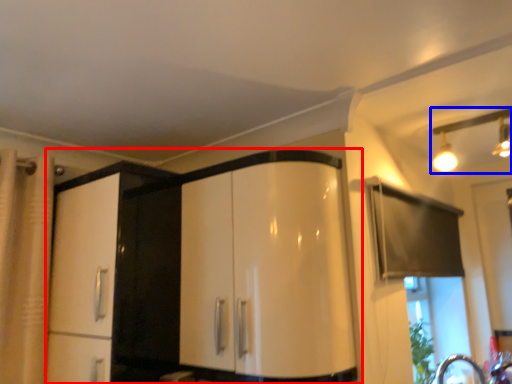
Question: Which object appears closest to the camera in this image, cabinetry (highlighted by a red box) or light fixture (highlighted by a blue box)?

Choices:
 (A) cabinetry
 (B) light fixture

Answer: (A)